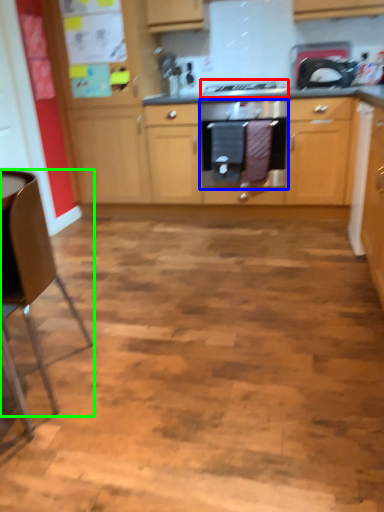
Question: Considering the real-world distances, which object is farthest from gas stove (highlighted by a red box)? home appliance (highlighted by a blue box) or chair (highlighted by a green box)?

Choices:
 (A) home appliance
 (B) chair

Answer: (B)